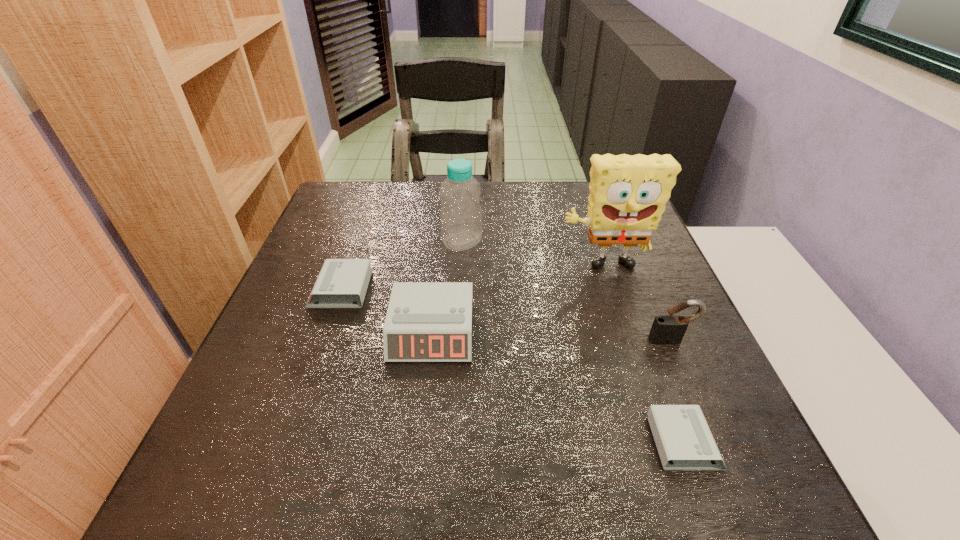
Image resolution: width=960 pixels, height=540 pixels. I want to click on the second shortest alarm clock, so click(x=341, y=282).

Locate an element on the screen. The image size is (960, 540). the leftmost object is located at coordinates (341, 282).

The width and height of the screenshot is (960, 540). Identify the location of the tallest alarm clock. (426, 321).

Identify the location of the second alarm clock from left to right. (426, 321).

Locate an element on the screen. Image resolution: width=960 pixels, height=540 pixels. the shortest object is located at coordinates (681, 433).

Locate an element on the screen. the shortest alarm clock is located at coordinates (681, 433).

Locate an element on the screen. the tallest object is located at coordinates (628, 194).

Where is `the second tallest object`? The height and width of the screenshot is (540, 960). the second tallest object is located at coordinates (461, 215).

Find the location of `the farthest object`. the farthest object is located at coordinates (461, 215).

You are a GUI agent. You are given a task and a screenshot of the screen. Output one action in this format:
    pyautogui.click(x=<x>, y=<y>)
    Task: Click on the padlock
    This screenshot has width=960, height=540.
    Given the screenshot: What is the action you would take?
    pyautogui.click(x=669, y=329)